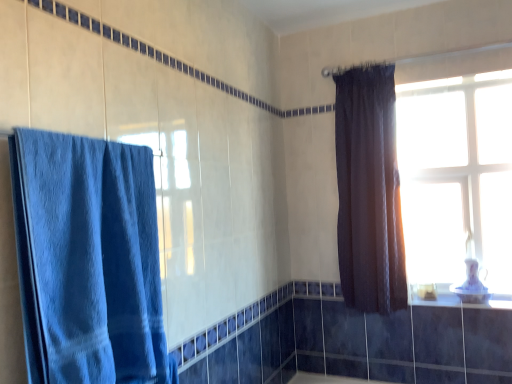
Question: From the image's perspective, is porcelain white window sill at lower right located beneath blue towel at left, acting as the second curtain starting from the right?

Choices:
 (A) yes
 (B) no

Answer: (A)

Question: From a real-world perspective, is porcelain white window sill at lower right on blue towel at left, arranged as the second curtain when viewed from the back?

Choices:
 (A) yes
 (B) no

Answer: (B)

Question: From a real-world perspective, is porcelain white window sill at lower right physically below blue towel at left, acting as the second curtain starting from the right?

Choices:
 (A) yes
 (B) no

Answer: (A)

Question: Does porcelain white window sill at lower right appear on the right side of blue towel at left, acting as the second curtain starting from the right?

Choices:
 (A) yes
 (B) no

Answer: (A)

Question: Is porcelain white window sill at lower right closer to the viewer compared to blue towel at left, acting as the second curtain starting from the right?

Choices:
 (A) yes
 (B) no

Answer: (B)

Question: Would you say transparent glass window at upper right is to the left or to the right of blue towel at left, the first curtain when ordered from front to back, in the picture?

Choices:
 (A) left
 (B) right

Answer: (B)

Question: In terms of width, does transparent glass window at upper right look wider or thinner when compared to blue towel at left, the first curtain when ordered from front to back?

Choices:
 (A) thin
 (B) wide

Answer: (A)

Question: Is transparent glass window at upper right in front of or behind blue towel at left, the 1th curtain from the left, in the image?

Choices:
 (A) front
 (B) behind

Answer: (B)

Question: Is transparent glass window at upper right inside or outside of blue towel at left, arranged as the second curtain when viewed from the back?

Choices:
 (A) outside
 (B) inside

Answer: (A)

Question: Is blue towel at left, arranged as the second curtain when viewed from the back, taller or shorter than transparent glass window at upper right?

Choices:
 (A) tall
 (B) short

Answer: (B)

Question: Is blue towel at left, acting as the second curtain starting from the right, to the left or to the right of transparent glass window at upper right in the image?

Choices:
 (A) left
 (B) right

Answer: (A)

Question: Based on their sizes in the image, would you say blue towel at left, arranged as the second curtain when viewed from the back, is bigger or smaller than transparent glass window at upper right?

Choices:
 (A) big
 (B) small

Answer: (A)

Question: From a real-world perspective, is blue towel at left, the first curtain when ordered from front to back, above or below transparent glass window at upper right?

Choices:
 (A) above
 (B) below

Answer: (B)

Question: Do you think dark matte curtain at upper right, which is counted as the 1th curtain, starting from the right, is within porcelain white window sill at lower right, or outside of it?

Choices:
 (A) outside
 (B) inside

Answer: (A)

Question: Is dark matte curtain at upper right, placed as the first curtain when sorted from back to front, taller or shorter than porcelain white window sill at lower right?

Choices:
 (A) tall
 (B) short

Answer: (A)